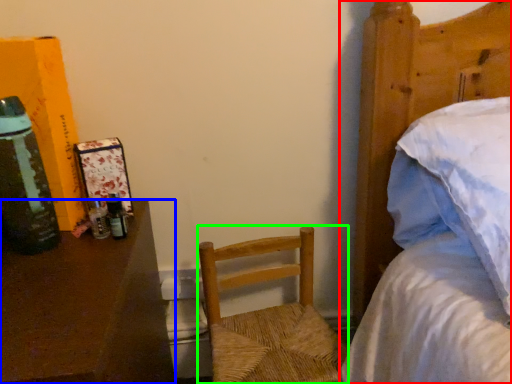
Question: Which is farther away from bed (highlighted by a red box)? desk (highlighted by a blue box) or chair (highlighted by a green box)?

Choices:
 (A) desk
 (B) chair

Answer: (A)